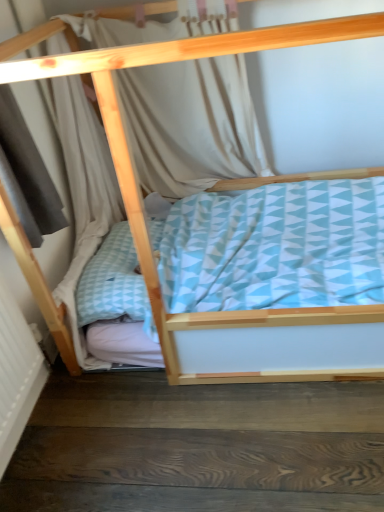
Question: Does point (259, 138) appear closer or farther from the camera than point (296, 467)?

Choices:
 (A) closer
 (B) farther

Answer: (B)

Question: From the image's perspective, relative to dark wood stair at lower left, is light beige fabric curtain at upper center above or below?

Choices:
 (A) below
 (B) above

Answer: (B)

Question: From a real-world perspective, relative to dark wood stair at lower left, is light beige fabric curtain at upper center vertically above or below?

Choices:
 (A) below
 (B) above

Answer: (B)

Question: Is dark wood stair at lower left inside or outside of light beige fabric curtain at upper center?

Choices:
 (A) outside
 (B) inside

Answer: (A)

Question: In the image, is dark wood stair at lower left positioned in front of or behind light beige fabric curtain at upper center?

Choices:
 (A) front
 (B) behind

Answer: (A)

Question: From a real-world perspective, is dark wood stair at lower left physically located above or below light beige fabric curtain at upper center?

Choices:
 (A) above
 (B) below

Answer: (B)

Question: Is point (124, 500) positioned closer to the camera than point (246, 83)?

Choices:
 (A) closer
 (B) farther

Answer: (A)